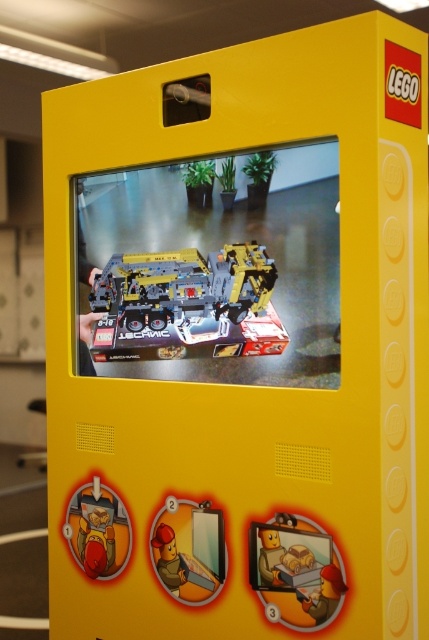
Question: In this image, where is yellow plastic lego set at center located relative to matte yellow minifigure at bottom right?

Choices:
 (A) left
 (B) right

Answer: (A)

Question: Is yellow plastic lego set at center smaller than matte yellow minifigure at bottom right?

Choices:
 (A) no
 (B) yes

Answer: (A)

Question: Which point is farther to the camera?

Choices:
 (A) yellow plastic lego set at center
 (B) matte yellow minifigure at bottom right

Answer: (A)

Question: Observing the image, what is the correct spatial positioning of yellow plastic lego set at center in reference to matte yellow minifigure at bottom right?

Choices:
 (A) left
 (B) right

Answer: (A)

Question: Which point is farther from the camera taking this photo?

Choices:
 (A) tap(319, 538)
 (B) tap(106, 262)

Answer: (B)